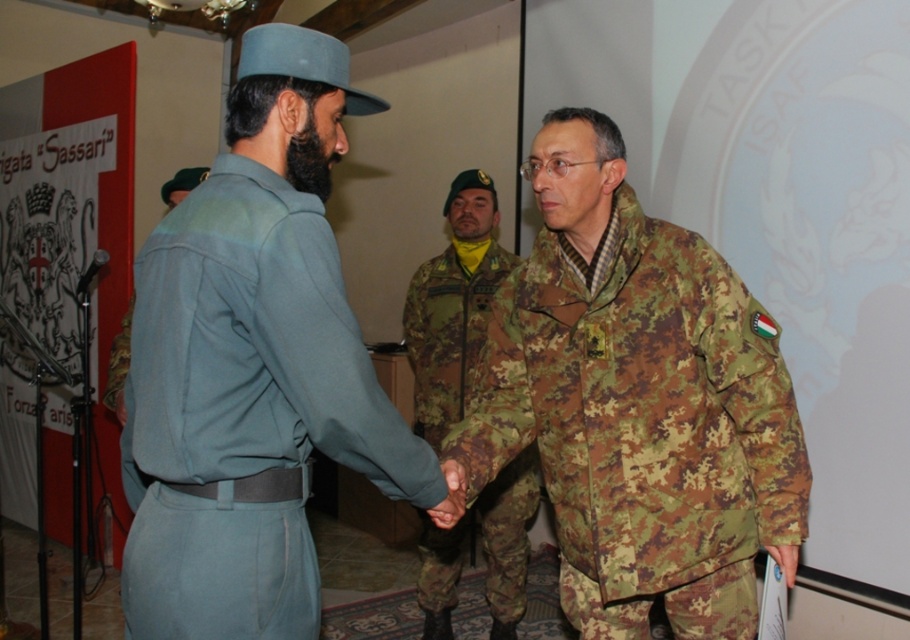
You are a photographer positioned to the right of the scene. You want to capture a clear photo of the camouflage fabric jacket at center without the camouflage fabric uniform at center blocking it. Is the jacket currently positioned in a way that allows this?

Yes, the camouflage fabric jacket at center is in front of the camouflage fabric uniform at center, so it is not blocked and can be photographed clearly.

You are a photographer standing in the scene and want to take a photo of the light blue uniform at center and camouflage fabric jacket at center. The minimum distance required for your camera to focus on both subjects clearly is 20 inches. Can you capture both subjects in focus without moving them?

The light blue uniform at center and camouflage fabric jacket at center are 21.30 inches apart, which exceeds the camera minimum focusing distance of 20 inches. Therefore, the camera cannot focus on both subjects clearly without moving them closer.

You are a photographer trying to capture the handshake between the two individuals in the scene. You need to focus your camera on the point at coordinate point (642, 424). Based on the scene description, can you determine what object this point is located on?

The point at coordinate point (642, 424) is located on the camouflage fabric jacket at center.